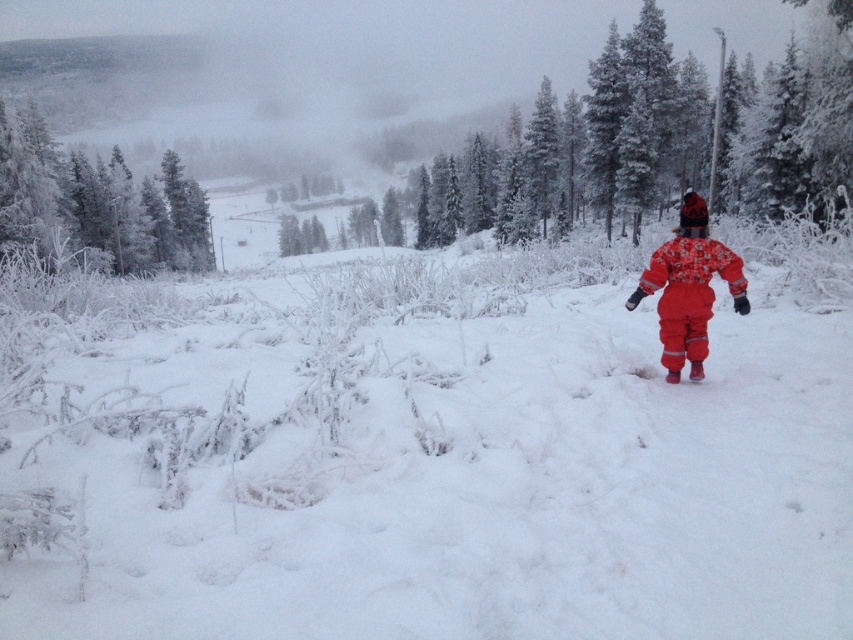
Is white fluffy snow at center below frosted pine trees at left?

Indeed, white fluffy snow at center is positioned under frosted pine trees at left.

Identify the location of white fluffy snow at center. Image resolution: width=853 pixels, height=640 pixels. (419, 454).

Identify the location of white fluffy snow at center. Image resolution: width=853 pixels, height=640 pixels. (419, 454).

What do you see at coordinates (97, 202) in the screenshot? I see `frosted pine trees at left` at bounding box center [97, 202].

Can you confirm if frosted pine trees at left is shorter than fluffy red snowsuit at right?

Incorrect, frosted pine trees at left's height does not fall short of fluffy red snowsuit at right's.

What do you see at coordinates (97, 202) in the screenshot?
I see `frosted pine trees at left` at bounding box center [97, 202].

The image size is (853, 640). Identify the location of frosted pine trees at left. (97, 202).

In the scene shown: Is white fluffy snow at center thinner than fluffy red snowsuit at right?

Incorrect, white fluffy snow at center's width is not less than fluffy red snowsuit at right's.

The width and height of the screenshot is (853, 640). What are the coordinates of `white fluffy snow at center` in the screenshot? It's located at (419, 454).